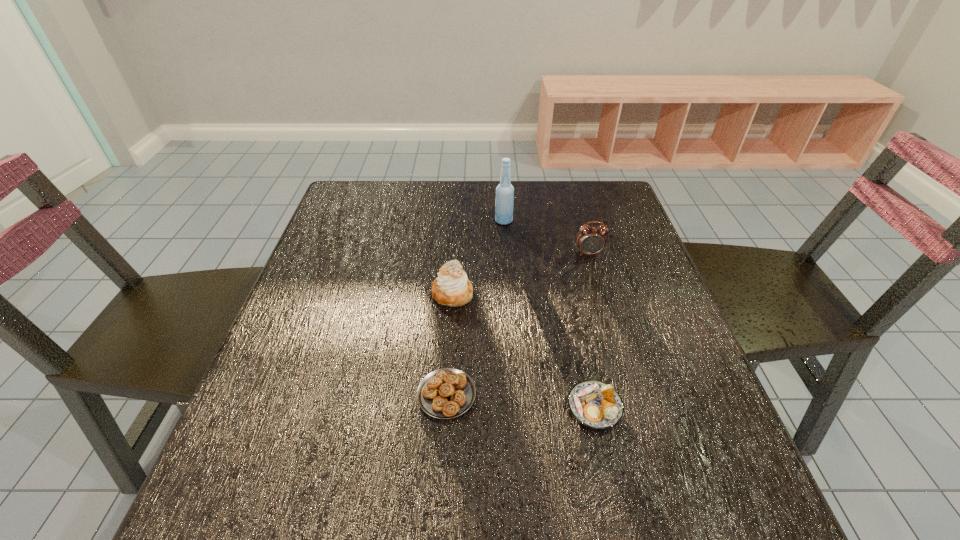
Locate an element on the screen. the farthest object is located at coordinates (504, 202).

The height and width of the screenshot is (540, 960). I want to click on the third object from left to right, so click(504, 202).

Where is `the fourth nearest object`? the fourth nearest object is located at coordinates (590, 240).

Find the location of a particular element. the tallest pastry is located at coordinates (452, 288).

I want to click on the third nearest object, so click(x=452, y=288).

Identify the location of the rightmost pastry. (595, 404).

This screenshot has width=960, height=540. Identify the location of the shortest pastry. (446, 393).

Locate an element on the screen. The height and width of the screenshot is (540, 960). vacant space located on the front of the third object from right to left is located at coordinates (505, 241).

This screenshot has width=960, height=540. What are the coordinates of `free region located 0.060m on the face of the alarm clock` in the screenshot? It's located at (594, 273).

Locate an element on the screen. The height and width of the screenshot is (540, 960). blank space located 0.090m on the right of the tallest pastry is located at coordinates (512, 294).